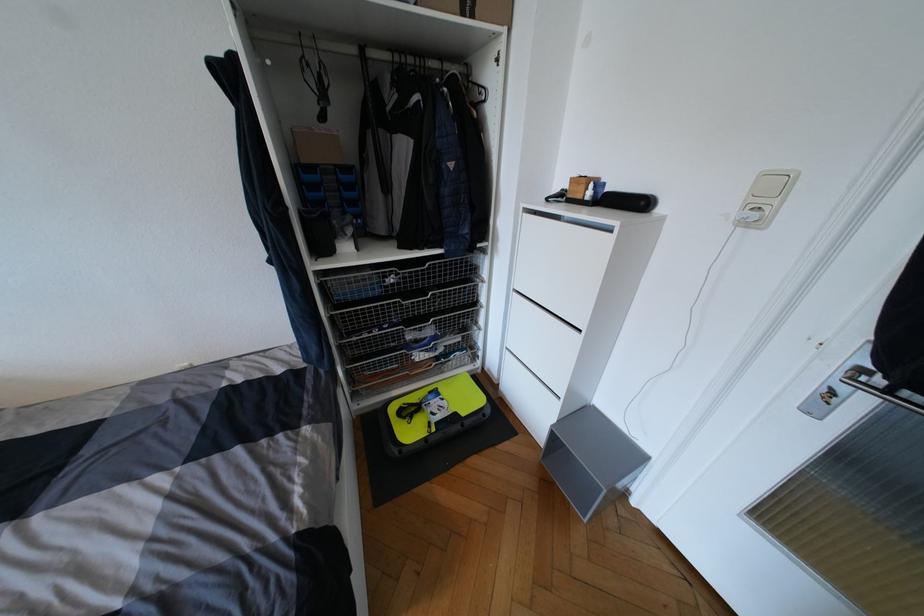
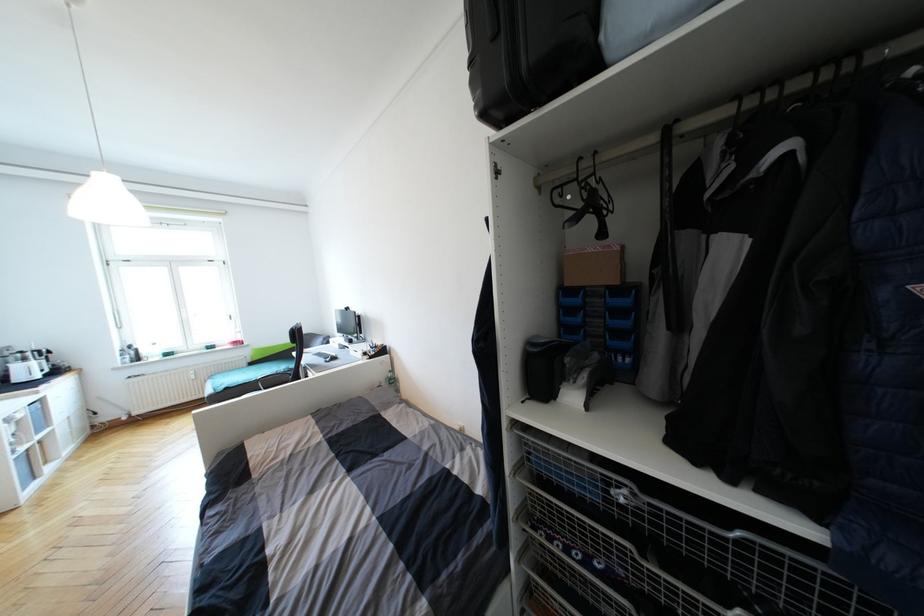
Where in the second image is the point corresponding to the point at 338,167 from the first image?

(611, 288)